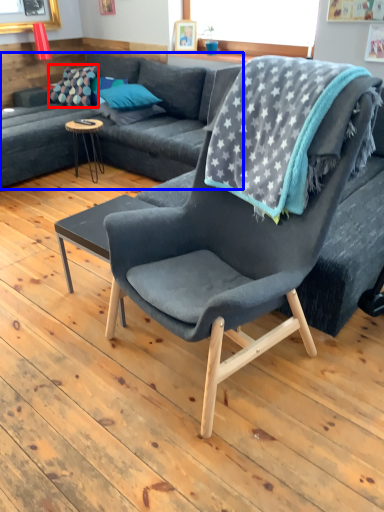
Question: Which point is closer to the camera, pillow (highlighted by a red box) or studio couch (highlighted by a blue box)?

Choices:
 (A) pillow
 (B) studio couch

Answer: (B)